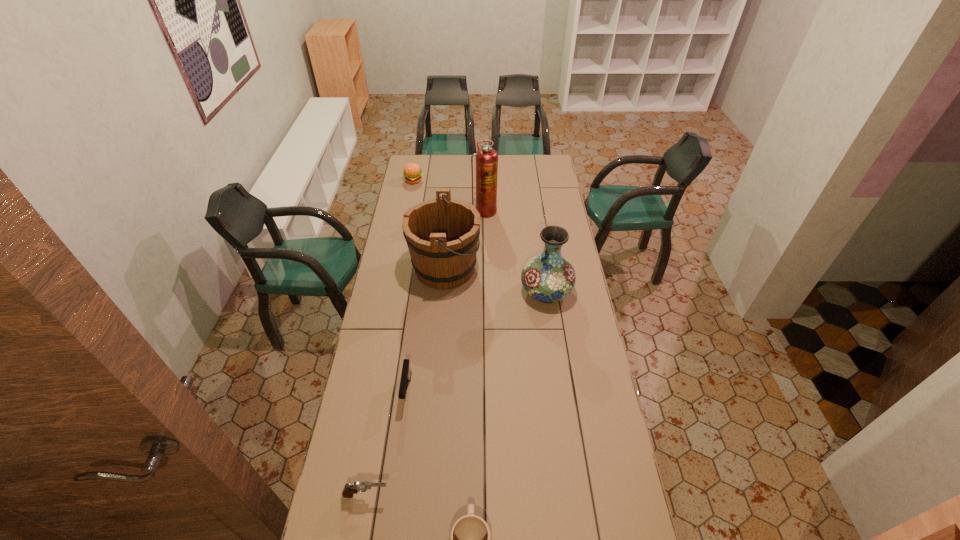
Image resolution: width=960 pixels, height=540 pixels. Identify the location of free space between the third nearest object and the fire extinguisher. (445, 301).

This screenshot has height=540, width=960. What are the coordinates of `unoccupied area between the fire extinguisher and the sixth farthest object` in the screenshot? It's located at (425, 353).

Where is `vacant area that lies between the vase and the farther pistol`? This screenshot has height=540, width=960. vacant area that lies between the vase and the farther pistol is located at coordinates (476, 341).

I want to click on unoccupied area between the third nearest object and the vase, so click(x=476, y=341).

Locate an element on the screen. The height and width of the screenshot is (540, 960). free space between the fire extinguisher and the sixth farthest object is located at coordinates (425, 353).

What are the coordinates of `empty space between the sixth farthest object and the tallest object` in the screenshot? It's located at (425, 353).

Identify which object is the sixth closest to the wine bucket. Please provide its 2D coordinates. Your answer should be formatted as a tuple, i.e. [(x, y)], where the tuple contains the x and y coordinates of a point satisfying the conditions above.

[(470, 539)]

Choose which object is the second nearest neighbor to the nearer pistol. Please provide its 2D coordinates. Your answer should be formatted as a tuple, i.e. [(x, y)], where the tuple contains the x and y coordinates of a point satisfying the conditions above.

[(406, 373)]

Locate an element on the screen. Image resolution: width=960 pixels, height=540 pixels. free space that satisfies the following two spatial constraints: 1. on the front side of the hamburger; 2. on the right side of the rightmost object is located at coordinates (393, 292).

The height and width of the screenshot is (540, 960). Find the location of `vacant area that satisfies the following two spatial constraints: 1. on the side of the wine bucket with the handle for carrying; 2. on the right side of the rightmost object`. vacant area that satisfies the following two spatial constraints: 1. on the side of the wine bucket with the handle for carrying; 2. on the right side of the rightmost object is located at coordinates (443, 292).